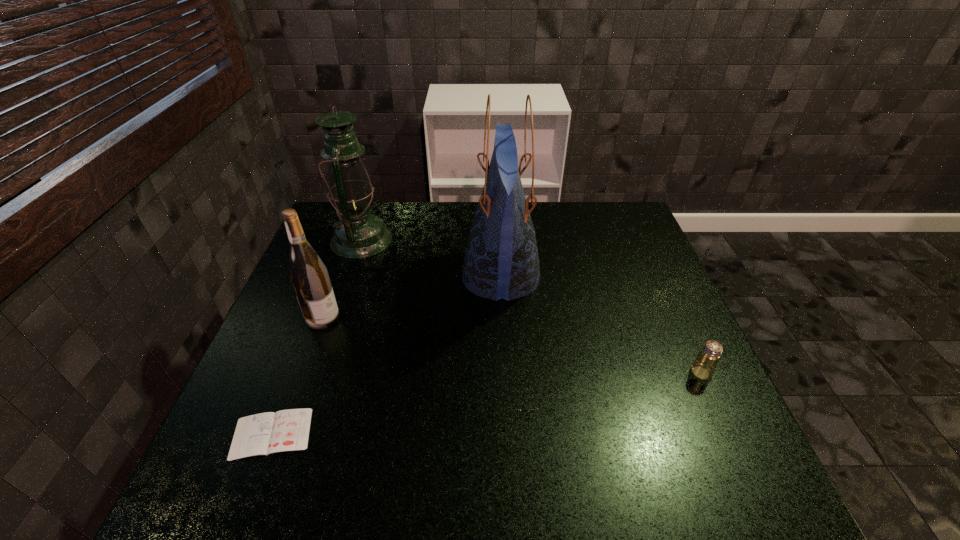
Image resolution: width=960 pixels, height=540 pixels. What are the coordinates of `object present at the far left corner` in the screenshot? It's located at (358, 234).

Identify the location of object that is at the near left corner. The width and height of the screenshot is (960, 540). (287, 430).

The width and height of the screenshot is (960, 540). In order to click on blank space at the far edge of the desktop in this screenshot , I will do `click(461, 210)`.

Identify the location of vacant point at the left edge. Image resolution: width=960 pixels, height=540 pixels. (280, 342).

This screenshot has width=960, height=540. In order to click on blank space at the right edge in this screenshot , I will do `click(678, 411)`.

The width and height of the screenshot is (960, 540). In the image, there is a desktop. Identify the location of blank space at the far right corner. (615, 201).

The height and width of the screenshot is (540, 960). Find the location of `vacant area that lies between the fourth tallest object and the shortest object`. vacant area that lies between the fourth tallest object and the shortest object is located at coordinates (487, 403).

Where is `vacant area that lies between the wine bottle and the fourth tallest object`? The width and height of the screenshot is (960, 540). vacant area that lies between the wine bottle and the fourth tallest object is located at coordinates (512, 345).

The width and height of the screenshot is (960, 540). In order to click on vacant space in between the third shortest object and the fourth tallest object in this screenshot , I will do `click(512, 345)`.

Identify the location of empty space between the shortest object and the tallest object. This screenshot has height=540, width=960. (386, 355).